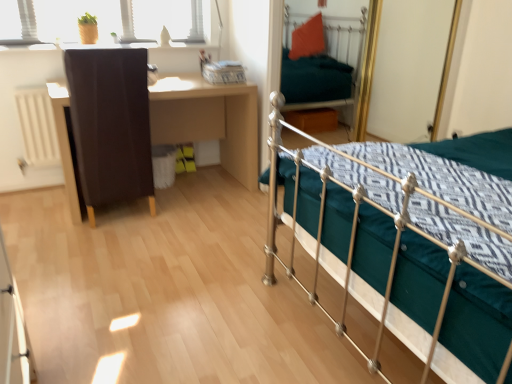
Question: Is matte brown cabinet at left thinner than metallic green bed at center?

Choices:
 (A) no
 (B) yes

Answer: (B)

Question: From a real-world perspective, does matte brown cabinet at left stand above metallic green bed at center?

Choices:
 (A) no
 (B) yes

Answer: (A)

Question: Does matte brown cabinet at left have a smaller size compared to metallic green bed at center?

Choices:
 (A) yes
 (B) no

Answer: (A)

Question: Does matte brown cabinet at left appear on the left side of metallic green bed at center?

Choices:
 (A) no
 (B) yes

Answer: (B)

Question: Is metallic green bed at center completely or partially inside matte brown cabinet at left?

Choices:
 (A) yes
 (B) no

Answer: (B)

Question: Considering the relative sizes of matte brown cabinet at left and metallic green bed at center in the image provided, is matte brown cabinet at left taller than metallic green bed at center?

Choices:
 (A) yes
 (B) no

Answer: (B)

Question: Is brown wooden desk at left far away from matte brown cabinet at left?

Choices:
 (A) yes
 (B) no

Answer: (B)

Question: Does brown wooden desk at left come in front of matte brown cabinet at left?

Choices:
 (A) yes
 (B) no

Answer: (B)

Question: From a real-world perspective, is brown wooden desk at left positioned under matte brown cabinet at left based on gravity?

Choices:
 (A) yes
 (B) no

Answer: (A)

Question: From the image's perspective, does brown wooden desk at left appear higher than matte brown cabinet at left?

Choices:
 (A) yes
 (B) no

Answer: (B)

Question: Is brown wooden desk at left turned away from matte brown cabinet at left?

Choices:
 (A) yes
 (B) no

Answer: (A)

Question: Is matte brown cabinet at left a part of brown wooden desk at left?

Choices:
 (A) yes
 (B) no

Answer: (A)

Question: From a real-world perspective, is metallic green bed at center located beneath matte brown cabinet at left?

Choices:
 (A) no
 (B) yes

Answer: (A)